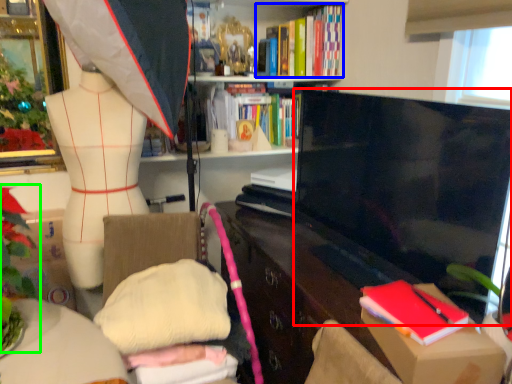
Question: Which object is the closest to the television (highlighted by a red box)? Choose among these: book (highlighted by a blue box) or floral arrangement (highlighted by a green box).

Choices:
 (A) book
 (B) floral arrangement

Answer: (A)